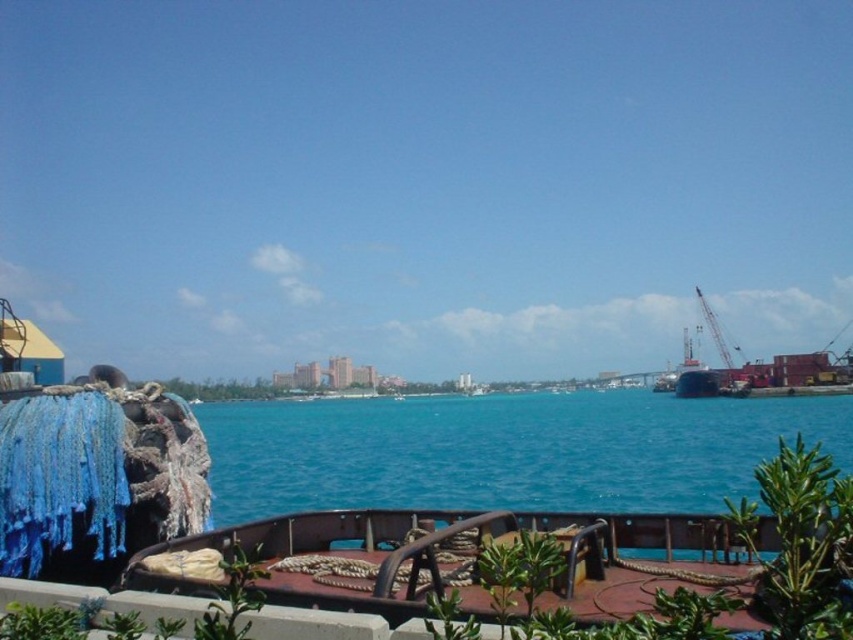
Question: Which object appears farthest from the camera in this image?

Choices:
 (A) metallic gray crane at right
 (B) blue water at center

Answer: (A)

Question: Is blue water at center above metallic gray crane at right?

Choices:
 (A) yes
 (B) no

Answer: (B)

Question: Does blue water at center have a larger size compared to metallic gray crane at right?

Choices:
 (A) yes
 (B) no

Answer: (A)

Question: Which of the following is the closest to the observer?

Choices:
 (A) metallic gray crane at right
 (B) blue water at center

Answer: (B)

Question: Can you confirm if blue water at center is positioned below metallic gray crane at right?

Choices:
 (A) yes
 (B) no

Answer: (A)

Question: Which point is farther to the camera?

Choices:
 (A) (340, 488)
 (B) (720, 355)

Answer: (B)